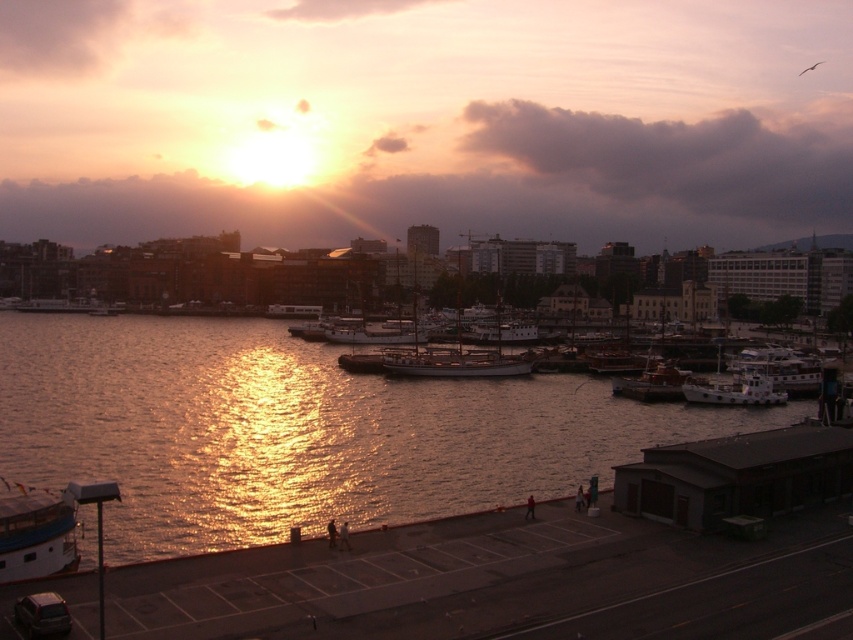
Question: Is smooth concrete dock at lower center further to the viewer compared to wooden boat at lower right?

Choices:
 (A) no
 (B) yes

Answer: (A)

Question: Considering the real-world distances, which object is farthest from the shiny golden water at center?

Choices:
 (A) white matte boat at lower right
 (B) white wooden boat at center right
 (C) smooth concrete dock at lower center

Answer: (B)

Question: Which point is closer to the camera?

Choices:
 (A) white glossy boat at lower left
 (B) wooden boat at lower right
 (C) white matte boat at lower right

Answer: (A)

Question: Which point is closer to the camera taking this photo?

Choices:
 (A) (711, 486)
 (B) (65, 372)

Answer: (A)

Question: Is white glossy boat at lower left thinner than white wooden boat at center right?

Choices:
 (A) yes
 (B) no

Answer: (A)

Question: Can you confirm if shiny golden water at center is positioned to the right of smooth concrete dock at lower center?

Choices:
 (A) yes
 (B) no

Answer: (B)